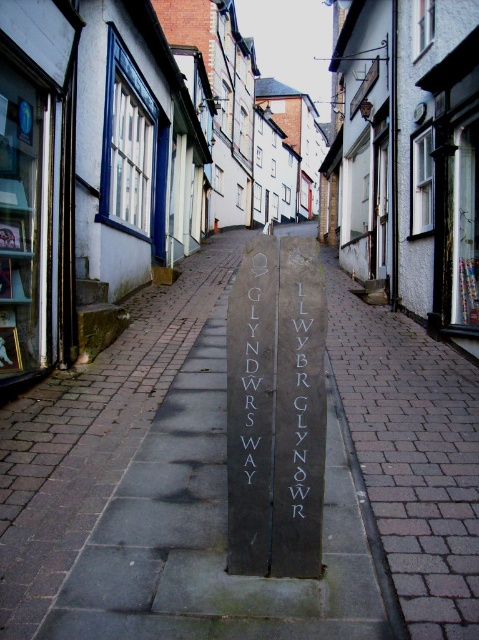
You are a tour guide leading a group down a narrow cobblestone street in a historic town. You want to point out both the dark gray stone marker at center and the slate gray stone sign at center to your group. Which one is shorter?

The dark gray stone marker at center is not as tall as the slate gray stone sign at center, so the dark gray stone marker at center is shorter.

You are a tourist holding a 12 inch ruler. You want to measure the distance between the dark gray stone marker at center and the white stone writing at center. Can your ruler reach both ends of this distance?

The distance between the dark gray stone marker at center and the white stone writing at center is 18.85 inches. Since your ruler is only 12 inches long, it cannot fully measure the distance between them.